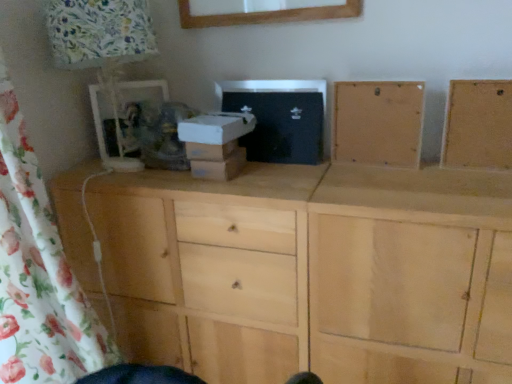
Image resolution: width=512 pixels, height=384 pixels. Find the location of `vacant area in front of white cardboard box at center`. vacant area in front of white cardboard box at center is located at coordinates (221, 184).